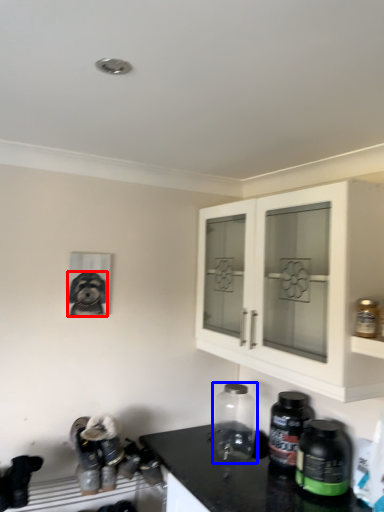
Question: Among these objects, which one is farthest to the camera, dog (highlighted by a red box) or bottle (highlighted by a blue box)?

Choices:
 (A) dog
 (B) bottle

Answer: (A)